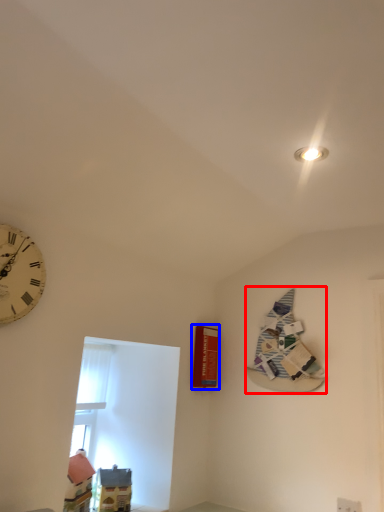
Question: Among these objects, which one is nearest to the camera, book (highlighted by a red box) or magazine (highlighted by a blue box)?

Choices:
 (A) book
 (B) magazine

Answer: (A)